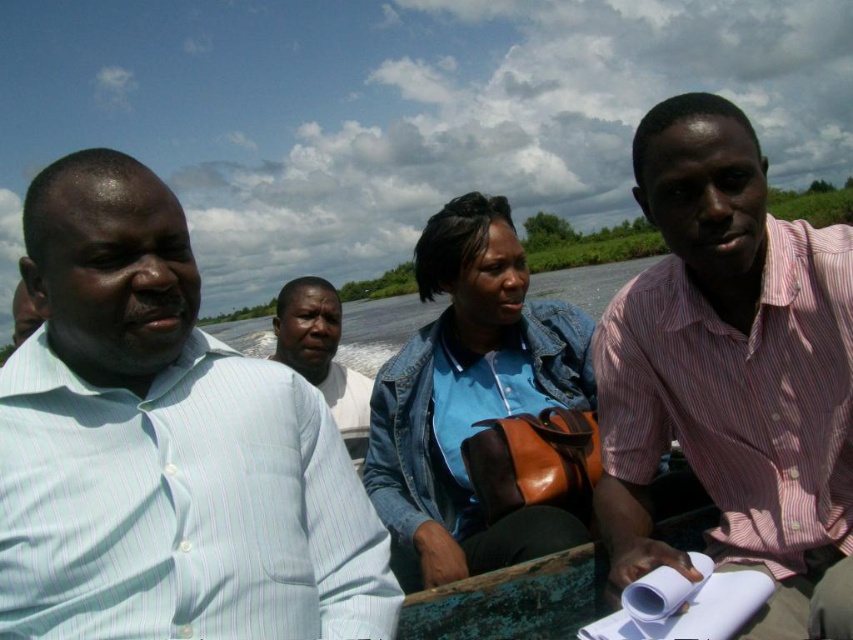
Question: Is pink striped shirt at right above light blue striped shirt at center?

Choices:
 (A) no
 (B) yes

Answer: (B)

Question: Does light blue striped shirt at left appear on the left side of pink striped shirt at right?

Choices:
 (A) no
 (B) yes

Answer: (B)

Question: Which point is closer to the camera?

Choices:
 (A) pos(692,348)
 (B) pos(531,362)

Answer: (A)

Question: Observing the image, what is the correct spatial positioning of pink striped shirt at right in reference to light blue striped shirt at center?

Choices:
 (A) right
 (B) left

Answer: (A)

Question: Among these objects, which one is farthest from the camera?

Choices:
 (A) blue denim jacket at center
 (B) pink striped shirt at right

Answer: (A)

Question: Based on their relative distances, which object is farther from the light blue striped shirt at center?

Choices:
 (A) blue denim jacket at center
 (B) pink striped shirt at right

Answer: (B)